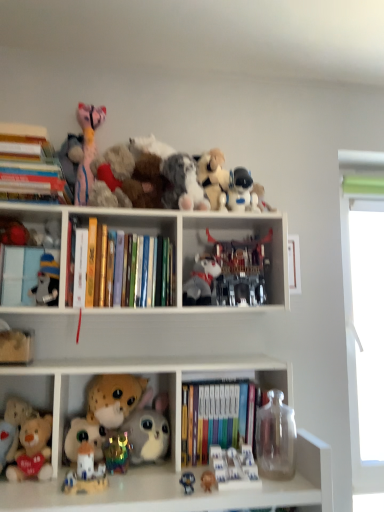
The width and height of the screenshot is (384, 512). Find the location of `transparent glass vase at lower right, which is counted as the 14th toy, starting from the left`. transparent glass vase at lower right, which is counted as the 14th toy, starting from the left is located at coordinates (276, 438).

This screenshot has height=512, width=384. I want to click on white matte bookshelf at upper center, positioned as the second shelf in bottom-to-top order, so click(x=172, y=257).

Measure the distance between white matte penguin at left and camera.

white matte penguin at left is 1.17 meters away from camera.

What do you see at coordinates (47, 282) in the screenshot? Image resolution: width=384 pixels, height=512 pixels. I see `matte gray plush at left, the thirteenth toy when ordered from right to left` at bounding box center [47, 282].

Where is `fluffy pink plush at upper center, which appears as the twelfth toy when viewed from the right`? fluffy pink plush at upper center, which appears as the twelfth toy when viewed from the right is located at coordinates (87, 149).

The image size is (384, 512). What do you see at coordinates (353, 293) in the screenshot?
I see `green fabric at right` at bounding box center [353, 293].

Identify the location of transparent glass vase at lower right, which is counted as the 14th toy, starting from the left. (276, 438).

Who is more distant, fluffy plush toy at upper center, the seventh toy viewed from the right, or transparent glass vase at lower right, which is counted as the 14th toy, starting from the left?

fluffy plush toy at upper center, the seventh toy viewed from the right, is further away from the camera.

Is fluffy plush toy at upper center, arranged as the 8th toy when viewed from the left, aimed at transparent glass vase at lower right, placed as the first toy when sorted from right to left?

No, fluffy plush toy at upper center, arranged as the 8th toy when viewed from the left, is not aimed at transparent glass vase at lower right, placed as the first toy when sorted from right to left.

From a real-world perspective, between fluffy plush toy at upper center, arranged as the 8th toy when viewed from the left, and transparent glass vase at lower right, which is counted as the 14th toy, starting from the left, who is vertically lower?

transparent glass vase at lower right, which is counted as the 14th toy, starting from the left, is physically lower.

Can you tell me how much fluffy plush toy at upper center, arranged as the 8th toy when viewed from the left, and transparent glass vase at lower right, placed as the first toy when sorted from right to left, differ in facing direction?

There is a 0.929-degree angle between the facing directions of fluffy plush toy at upper center, arranged as the 8th toy when viewed from the left, and transparent glass vase at lower right, placed as the first toy when sorted from right to left.

How distant is hardcover books at center, marked as the 2th book in a left-to-right arrangement, from fuzzy beige stuffed animal at lower left, placed as the 1th toy when sorted from left to right?

hardcover books at center, marked as the 2th book in a left-to-right arrangement, is 30.64 centimeters from fuzzy beige stuffed animal at lower left, placed as the 1th toy when sorted from left to right.

Between hardcover books at center, which is counted as the 2th book, starting from the right, and fuzzy beige stuffed animal at lower left, which is the 14th toy in right-to-left order, which one appears on the left side from the viewer's perspective?

fuzzy beige stuffed animal at lower left, which is the 14th toy in right-to-left order.

Which object is wider, hardcover books at center, which is counted as the 2th book, starting from the right, or fuzzy beige stuffed animal at lower left, which is the 14th toy in right-to-left order?

fuzzy beige stuffed animal at lower left, which is the 14th toy in right-to-left order, is wider.

From the picture: Which of these two, hardcover books at center, which is counted as the 2th book, starting from the right, or fuzzy beige stuffed animal at lower left, placed as the 1th toy when sorted from left to right, is bigger?

hardcover books at center, which is counted as the 2th book, starting from the right, is bigger.

Is matte gray plush at left, the thirteenth toy when ordered from right to left, facing away from fluffy pink plush at upper center, which appears as the twelfth toy when viewed from the right?

That's not correct — matte gray plush at left, the thirteenth toy when ordered from right to left, is not looking away from fluffy pink plush at upper center, which appears as the twelfth toy when viewed from the right.

Considering the relative sizes of matte gray plush at left, the thirteenth toy when ordered from right to left, and fluffy pink plush at upper center, which appears as the twelfth toy when viewed from the right, in the image provided, is matte gray plush at left, the thirteenth toy when ordered from right to left, shorter than fluffy pink plush at upper center, which appears as the twelfth toy when viewed from the right,?

Indeed, matte gray plush at left, the thirteenth toy when ordered from right to left, has a lesser height compared to fluffy pink plush at upper center, which appears as the twelfth toy when viewed from the right.

Is point (46, 282) more distant than point (94, 132)?

No, (46, 282) is in front of (94, 132).

Is matte gray plush at left, the thirteenth toy when ordered from right to left, situated inside fluffy pink plush at upper center, which ranks as the third toy in left-to-right order, or outside?

Answer: matte gray plush at left, the thirteenth toy when ordered from right to left, is located beyond the bounds of fluffy pink plush at upper center, which ranks as the third toy in left-to-right order.

What's the angular difference between white matte cards at lower center, the 4th toy positioned from the right, and hardcover books at center, arranged as the third book when viewed from the left,'s facing directions?

0.205 degrees.

Are white matte cards at lower center, the eleventh toy from the left, and hardcover books at center, the 3th book from the top, far apart?

Actually, white matte cards at lower center, the eleventh toy from the left, and hardcover books at center, the 3th book from the top, are a little close together.

Is white matte cards at lower center, the eleventh toy from the left, turned away from hardcover books at center, the 1th book from the bottom?

Yes.

Looking at this image, is the position of white matte cards at lower center, the 4th toy positioned from the right, more distant than that of hardcover books at center, the 3th book from the top?

No, white matte cards at lower center, the 4th toy positioned from the right, is closer to the viewer.

How different are the orientations of fuzzy beige stuffed animal at lower left, which is the 14th toy in right-to-left order, and gold paper at upper center in degrees?

The facing directions of fuzzy beige stuffed animal at lower left, which is the 14th toy in right-to-left order, and gold paper at upper center are 2.31 degrees apart.

Considering the positions of point (18, 355) and point (92, 277), is point (18, 355) closer or farther from the camera than point (92, 277)?

Clearly, point (18, 355) is closer to the camera than point (92, 277).

The width and height of the screenshot is (384, 512). Identify the location of the 3rd toy directly beneath the gold paper at upper center (from a real-world perspective). pos(15,345).

In the image, is fuzzy beige stuffed animal at lower left, placed as the 1th toy when sorted from left to right, positioned in front of or behind gold paper at upper center?

fuzzy beige stuffed animal at lower left, placed as the 1th toy when sorted from left to right, is positioned closer to the viewer than gold paper at upper center.

In terms of width, does hardcover book at upper left, which appears as the 1th book when viewed from the left, look wider or thinner when compared to white plastic toy house at lower left, which ranks as the 5th toy in left-to-right order?

In the image, hardcover book at upper left, which appears as the 1th book when viewed from the left, appears to be wider than white plastic toy house at lower left, which ranks as the 5th toy in left-to-right order.

From a real-world perspective, is hardcover book at upper left, which appears as the third book when ordered from the bottom, positioned under white plastic toy house at lower left, which is counted as the tenth toy, starting from the right, based on gravity?

No.

From the picture: From the image's perspective, does hardcover book at upper left, which appears as the 1th book when viewed from the left, appear higher than white plastic toy house at lower left, which is counted as the tenth toy, starting from the right?

Indeed, from the image's perspective, hardcover book at upper left, which appears as the 1th book when viewed from the left, is shown above white plastic toy house at lower left, which is counted as the tenth toy, starting from the right.

Between hardcover book at upper left, which appears as the third book when ordered from the bottom, and white plastic toy house at lower left, which is counted as the tenth toy, starting from the right, which one has more height?

Standing taller between the two is hardcover book at upper left, which appears as the third book when ordered from the bottom.

From a real-world perspective, relative to fluffy pink plush at upper center, which ranks as the third toy in left-to-right order, is white plush toy at lower left, which is the 11th toy from right to left, vertically above or below?

Clearly, from a real-world perspective, white plush toy at lower left, which is the 11th toy from right to left, is below fluffy pink plush at upper center, which ranks as the third toy in left-to-right order.

Considering the relative sizes of white plush toy at lower left, which is the 11th toy from right to left, and fluffy pink plush at upper center, which ranks as the third toy in left-to-right order, in the image provided, is white plush toy at lower left, which is the 11th toy from right to left, bigger than fluffy pink plush at upper center, which ranks as the third toy in left-to-right order,?

Actually, white plush toy at lower left, which is the 11th toy from right to left, might be smaller than fluffy pink plush at upper center, which ranks as the third toy in left-to-right order.

Does white plush toy at lower left, which is the 4th toy in left-to-right order, have a lesser width compared to fluffy pink plush at upper center, which ranks as the third toy in left-to-right order?

Indeed, white plush toy at lower left, which is the 4th toy in left-to-right order, has a lesser width compared to fluffy pink plush at upper center, which ranks as the third toy in left-to-right order.

Relative to fluffy pink plush at upper center, which ranks as the third toy in left-to-right order, is white plush toy at lower left, which is the 11th toy from right to left, in front or behind?

white plush toy at lower left, which is the 11th toy from right to left, is in front of fluffy pink plush at upper center, which ranks as the third toy in left-to-right order.

What are the coordinates of `the 7th toy positioned above the transparent glass vase at lower right, which is counted as the 14th toy, starting from the left (from a real-world perspective)` in the screenshot? It's located at (182, 184).

Identify the location of the 2nd book counting from the right side of the fuzzy beige stuffed animal at lower left, placed as the 1th toy when sorted from left to right. Image resolution: width=384 pixels, height=512 pixels. (119, 268).

In the scene shown: From the image, which object appears to be nearer to white plastic toy at center, which appears as the 5th toy when viewed from the right, hardcover book at upper left, marked as the third book in a right-to-left arrangement, or fluffy plush toy at lower center, which appears as the 6th toy when viewed from the left?

Based on the image, fluffy plush toy at lower center, which appears as the 6th toy when viewed from the left, appears to be nearer to white plastic toy at center, which appears as the 5th toy when viewed from the right.

Based on their spatial positions, is hardcover books at center, marked as the second book in a top-to-bottom arrangement, or white plastic toy house at lower left, which ranks as the 5th toy in left-to-right order, closer to white plush toy at lower left, which is the 11th toy from right to left?

Based on the image, white plastic toy house at lower left, which ranks as the 5th toy in left-to-right order, appears to be nearer to white plush toy at lower left, which is the 11th toy from right to left.

When comparing their distances from fuzzy beige stuffed animal at lower left, which is the 14th toy in right-to-left order, does matte gray plush at left, the thirteenth toy when ordered from right to left, or fluffy beige teddy bear at lower left, acting as the first shelf starting from the bottom, seem further?

fluffy beige teddy bear at lower left, acting as the first shelf starting from the bottom, lies further to fuzzy beige stuffed animal at lower left, which is the 14th toy in right-to-left order, than the other object.

From the image, which object appears to be nearer to matte gray plush at left, positioned as the 2th toy in left-to-right order, fluffy pink plush at upper center, which appears as the twelfth toy when viewed from the right, or hardcover books at center, marked as the second book in a top-to-bottom arrangement?

hardcover books at center, marked as the second book in a top-to-bottom arrangement, lies closer to matte gray plush at left, positioned as the 2th toy in left-to-right order, than the other object.

Estimate the real-world distances between objects in this image. Which object is closer to white plush toy at lower left, which is the 11th toy from right to left, green fabric at right or fluffy plush toy at lower center, which appears as the 6th toy when viewed from the left?

fluffy plush toy at lower center, which appears as the 6th toy when viewed from the left, is positioned closer to the anchor white plush toy at lower left, which is the 11th toy from right to left.

Which object lies nearer to the anchor point fluffy pink plush at upper center, which appears as the twelfth toy when viewed from the right, white plastic toy house at lower left, which is counted as the tenth toy, starting from the right, or white matte cards at lower center, the 4th toy positioned from the right?

white plastic toy house at lower left, which is counted as the tenth toy, starting from the right, is closer to fluffy pink plush at upper center, which appears as the twelfth toy when viewed from the right.

From the image, which object appears to be farther from white matte bookshelf at upper center, the 1th shelf positioned from the top, fluffy plush toy at upper center, arranged as the 8th toy when viewed from the left, or matte gray plush at left, positioned as the 2th toy in left-to-right order?

matte gray plush at left, positioned as the 2th toy in left-to-right order, lies further to white matte bookshelf at upper center, the 1th shelf positioned from the top, than the other object.

Estimate the real-world distances between objects in this image. Which object is further from white matte penguin at left, gold paper at upper center or white matte cards at lower center, the 4th toy positioned from the right?

white matte cards at lower center, the 4th toy positioned from the right.

At what (x,y) coordinates should I click in order to perform the action: click on cabinet that lies between hardcover book at upper left, marked as the third book in a right-to-left arrangement, and white plush toy at lower left, which is the 11th toy from right to left, from top to bottom. Please return your answer as a coordinate pair (x, y). The width and height of the screenshot is (384, 512). Looking at the image, I should click on (36, 268).

Identify the location of shelf between fluffy plush toy at upper center, arranged as the 8th toy when viewed from the left, and gold paper at upper center, in the vertical direction. (172, 257).

Identify the location of cabinet between white plastic robot at upper center, placed as the 13th toy when sorted from left to right, and white plastic toy house at lower left, which is counted as the tenth toy, starting from the right, from top to bottom. (36, 268).

Locate an element on the screen. paperback book between hardcover book at upper left, which appears as the third book when ordered from the bottom, and white matte cards at lower center, the 4th toy positioned from the right, in the vertical direction is located at coordinates (91, 262).